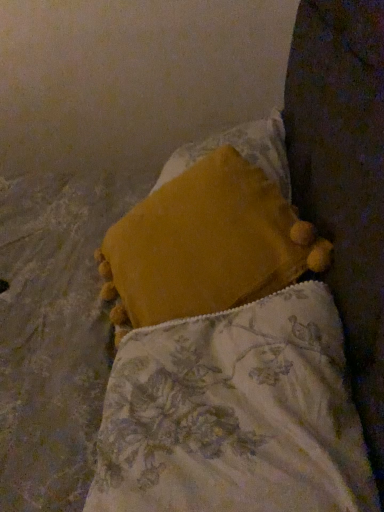
Identify the location of velvety yellow pillow at center, placed as the second pillow when sorted from front to back. (205, 245).

The height and width of the screenshot is (512, 384). Describe the element at coordinates (205, 245) in the screenshot. I see `velvety yellow pillow at center, which is counted as the 1th pillow, starting from the back` at that location.

Image resolution: width=384 pixels, height=512 pixels. What do you see at coordinates (235, 415) in the screenshot?
I see `velvet yellow pillow at center, which is the second pillow in back-to-front order` at bounding box center [235, 415].

You are a GUI agent. You are given a task and a screenshot of the screen. Output one action in this format:
    pyautogui.click(x=<x>, y=<y>)
    Task: Click on the velvet yellow pillow at center, marked as the 1th pillow in a front-to-back arrangement
    The width and height of the screenshot is (384, 512).
    Given the screenshot: What is the action you would take?
    pyautogui.click(x=235, y=415)

Locate an element on the screen. The height and width of the screenshot is (512, 384). velvety yellow pillow at center, which is counted as the 1th pillow, starting from the back is located at coordinates pyautogui.click(x=205, y=245).

In the scene shown: Is velvety yellow pillow at center, placed as the second pillow when sorted from front to back, to the left of velvet yellow pillow at center, which is the second pillow in back-to-front order, from the viewer's perspective?

Incorrect, velvety yellow pillow at center, placed as the second pillow when sorted from front to back, is not on the left side of velvet yellow pillow at center, which is the second pillow in back-to-front order.

In the image, is velvety yellow pillow at center, which is counted as the 1th pillow, starting from the back, positioned in front of or behind velvet yellow pillow at center, marked as the 1th pillow in a front-to-back arrangement?

Clearly, velvety yellow pillow at center, which is counted as the 1th pillow, starting from the back, is behind velvet yellow pillow at center, marked as the 1th pillow in a front-to-back arrangement.

Which is closer, (251, 291) or (199, 492)?

Point (251, 291) appears to be farther away from the viewer than point (199, 492).

From the image's perspective, is velvety yellow pillow at center, placed as the second pillow when sorted from front to back, under velvet yellow pillow at center, marked as the 1th pillow in a front-to-back arrangement?

Answer: No, from the image's perspective, velvety yellow pillow at center, placed as the second pillow when sorted from front to back, is not below velvet yellow pillow at center, marked as the 1th pillow in a front-to-back arrangement.

From a real-world perspective, between velvety yellow pillow at center, placed as the second pillow when sorted from front to back, and velvet yellow pillow at center, marked as the 1th pillow in a front-to-back arrangement, who is vertically higher?

From a 3D spatial view, velvety yellow pillow at center, placed as the second pillow when sorted from front to back, is above.

Can you confirm if velvety yellow pillow at center, which is counted as the 1th pillow, starting from the back, is thinner than velvet yellow pillow at center, marked as the 1th pillow in a front-to-back arrangement?

Correct, the width of velvety yellow pillow at center, which is counted as the 1th pillow, starting from the back, is less than that of velvet yellow pillow at center, marked as the 1th pillow in a front-to-back arrangement.

Considering the sizes of velvety yellow pillow at center, placed as the second pillow when sorted from front to back, and velvet yellow pillow at center, marked as the 1th pillow in a front-to-back arrangement, in the image, is velvety yellow pillow at center, placed as the second pillow when sorted from front to back, taller or shorter than velvet yellow pillow at center, marked as the 1th pillow in a front-to-back arrangement,?

Considering their sizes, velvety yellow pillow at center, placed as the second pillow when sorted from front to back, has less height than velvet yellow pillow at center, marked as the 1th pillow in a front-to-back arrangement.

Does velvety yellow pillow at center, placed as the second pillow when sorted from front to back, have a smaller size compared to velvet yellow pillow at center, which is the second pillow in back-to-front order?

No.

Is velvety yellow pillow at center, which is counted as the 1th pillow, starting from the back, situated inside velvet yellow pillow at center, which is the second pillow in back-to-front order, or outside?

velvety yellow pillow at center, which is counted as the 1th pillow, starting from the back, exists outside the volume of velvet yellow pillow at center, which is the second pillow in back-to-front order.

Is velvety yellow pillow at center, placed as the second pillow when sorted from front to back, not close to velvet yellow pillow at center, marked as the 1th pillow in a front-to-back arrangement?

Actually, velvety yellow pillow at center, placed as the second pillow when sorted from front to back, and velvet yellow pillow at center, marked as the 1th pillow in a front-to-back arrangement, are a little close together.

Is velvety yellow pillow at center, which is counted as the 1th pillow, starting from the back, looking in the opposite direction of velvet yellow pillow at center, which is the second pillow in back-to-front order?

No, velvety yellow pillow at center, which is counted as the 1th pillow, starting from the back,'s orientation is not away from velvet yellow pillow at center, which is the second pillow in back-to-front order.

Based on the photo, how distant is velvety yellow pillow at center, placed as the second pillow when sorted from front to back, from velvet yellow pillow at center, which is the second pillow in back-to-front order?

They are 8.49 inches apart.

Find the location of a particular element. pillow that is above the velvet yellow pillow at center, marked as the 1th pillow in a front-to-back arrangement (from the image's perspective) is located at coordinates (205, 245).

Considering the relative positions of velvet yellow pillow at center, which is the second pillow in back-to-front order, and velvety yellow pillow at center, which is counted as the 1th pillow, starting from the back, in the image provided, is velvet yellow pillow at center, which is the second pillow in back-to-front order, to the left of velvety yellow pillow at center, which is counted as the 1th pillow, starting from the back, from the viewer's perspective?

Yes.

Considering their positions, is velvet yellow pillow at center, which is the second pillow in back-to-front order, located in front of or behind velvety yellow pillow at center, placed as the second pillow when sorted from front to back?

Clearly, velvet yellow pillow at center, which is the second pillow in back-to-front order, is in front of velvety yellow pillow at center, placed as the second pillow when sorted from front to back.

Does point (189, 449) appear closer or farther from the camera than point (199, 184)?

Point (189, 449) is positioned closer to the camera compared to point (199, 184).

From the image's perspective, which is above, velvet yellow pillow at center, which is the second pillow in back-to-front order, or velvety yellow pillow at center, which is counted as the 1th pillow, starting from the back?

velvety yellow pillow at center, which is counted as the 1th pillow, starting from the back.

From a real-world perspective, which object rests below the other?

In real-world perspective, velvet yellow pillow at center, which is the second pillow in back-to-front order, is lower.

Which object is thinner, velvet yellow pillow at center, marked as the 1th pillow in a front-to-back arrangement, or velvety yellow pillow at center, which is counted as the 1th pillow, starting from the back?

velvety yellow pillow at center, which is counted as the 1th pillow, starting from the back, is thinner.

Is velvet yellow pillow at center, which is the second pillow in back-to-front order, taller or shorter than velvety yellow pillow at center, placed as the second pillow when sorted from front to back?

velvet yellow pillow at center, which is the second pillow in back-to-front order, is taller than velvety yellow pillow at center, placed as the second pillow when sorted from front to back.

Is velvet yellow pillow at center, which is the second pillow in back-to-front order, bigger than velvety yellow pillow at center, placed as the second pillow when sorted from front to back?

Actually, velvet yellow pillow at center, which is the second pillow in back-to-front order, might be smaller than velvety yellow pillow at center, placed as the second pillow when sorted from front to back.

Is velvet yellow pillow at center, which is the second pillow in back-to-front order, outside of velvety yellow pillow at center, placed as the second pillow when sorted from front to back?

Yes, velvet yellow pillow at center, which is the second pillow in back-to-front order, is located beyond the bounds of velvety yellow pillow at center, placed as the second pillow when sorted from front to back.

Is velvet yellow pillow at center, marked as the 1th pillow in a front-to-back arrangement, in contact with velvety yellow pillow at center, placed as the second pillow when sorted from front to back?

velvet yellow pillow at center, marked as the 1th pillow in a front-to-back arrangement, is not next to velvety yellow pillow at center, placed as the second pillow when sorted from front to back, and they're not touching.

Could you tell me if velvet yellow pillow at center, which is the second pillow in back-to-front order, is facing velvety yellow pillow at center, which is counted as the 1th pillow, starting from the back?

No, velvet yellow pillow at center, which is the second pillow in back-to-front order, is not aimed at velvety yellow pillow at center, which is counted as the 1th pillow, starting from the back.

Based on the photo, what's the angular difference between velvet yellow pillow at center, marked as the 1th pillow in a front-to-back arrangement, and velvety yellow pillow at center, which is counted as the 1th pillow, starting from the back,'s facing directions?

They differ by 0.601 degrees in their facing directions.

Find the location of a particular element. pillow on the right of velvet yellow pillow at center, marked as the 1th pillow in a front-to-back arrangement is located at coordinates (205, 245).

Locate an element on the screen. pillow that is above the velvet yellow pillow at center, which is the second pillow in back-to-front order (from the image's perspective) is located at coordinates (205, 245).

Locate an element on the screen. pillow that appears below the velvety yellow pillow at center, placed as the second pillow when sorted from front to back (from a real-world perspective) is located at coordinates (235, 415).